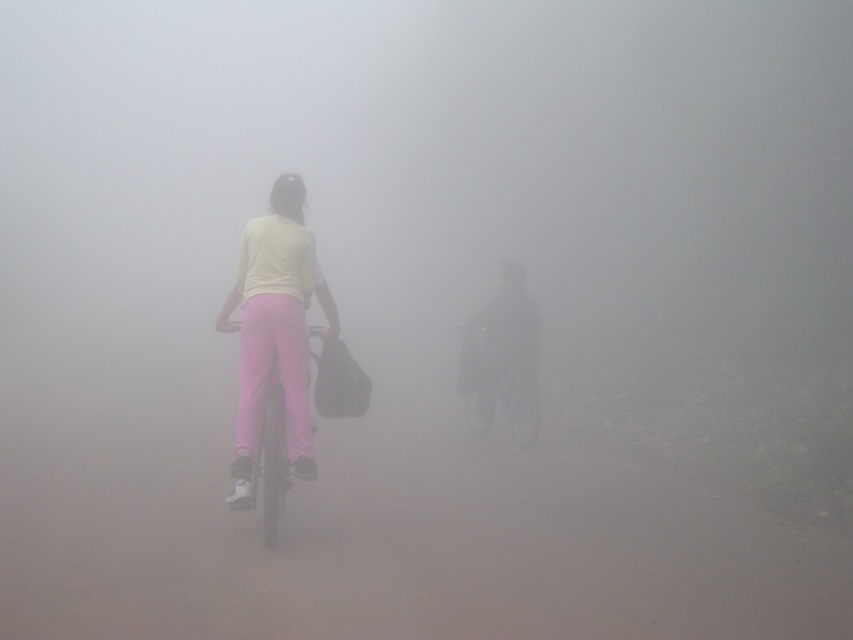
Who is taller, matte pink pants at center or pink matte pants at center?

Standing taller between the two is matte pink pants at center.

Is matte pink pants at center positioned at the back of pink matte pants at center?

No.

Identify the location of matte pink pants at center. (276, 330).

Where is `matte pink pants at center`? The image size is (853, 640). matte pink pants at center is located at coordinates (276, 330).

Is dark matte jacket at center wider than pink matte pants at center?

Indeed, dark matte jacket at center has a greater width compared to pink matte pants at center.

Who is more forward, (535, 371) or (281, 332)?

Point (281, 332) is in front.

Is point (524, 392) positioned behind point (256, 410)?

Yes, it is behind point (256, 410).

Find the location of a particular element. dark matte jacket at center is located at coordinates (500, 355).

Measure the distance between pink matte pants at center and camera.

They are 5.34 meters apart.

Can you confirm if pink matte pants at center is shorter than matte pink bicycle at center?

Yes.

Find the location of `pink matte pants at center`. pink matte pants at center is located at coordinates (270, 371).